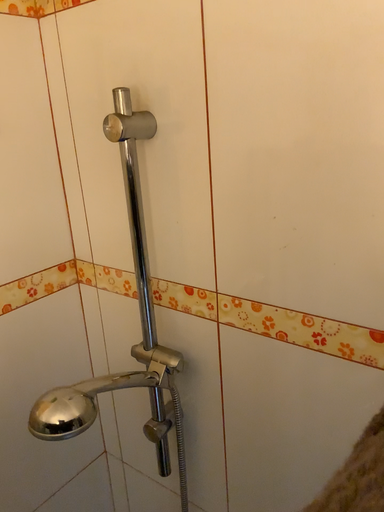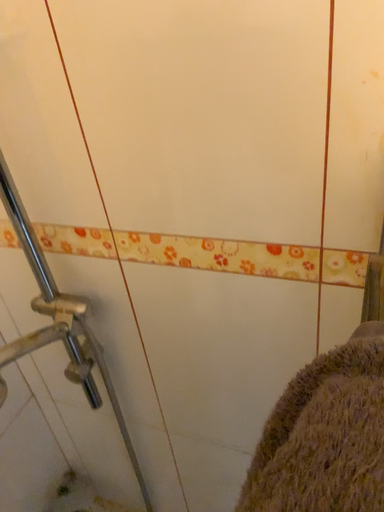
Question: How did the camera likely rotate when shooting the video?

Choices:
 (A) rotated upward
 (B) rotated downward

Answer: (B)